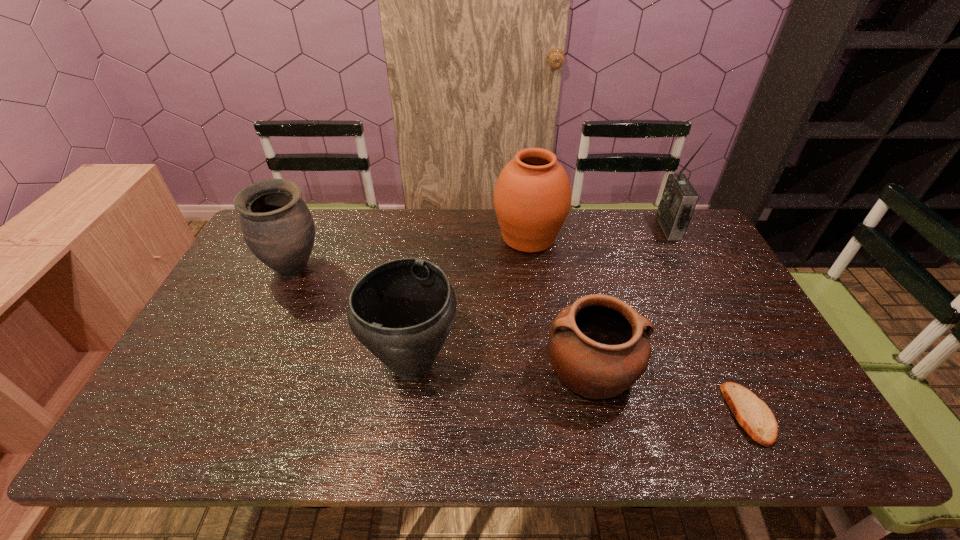
You are a GUI agent. You are given a task and a screenshot of the screen. Output one action in this format:
    pyautogui.click(x=<x>, y=<y>)
    Task: Click on the vacant region located on the right of the rightmost urn
    The height and width of the screenshot is (540, 960).
    Given the screenshot: What is the action you would take?
    pyautogui.click(x=668, y=237)

This screenshot has height=540, width=960. Find the location of `free location located on the right of the leftmost object`. free location located on the right of the leftmost object is located at coordinates (418, 268).

Where is `vacant point located on the left of the second urn from left to right`? The width and height of the screenshot is (960, 540). vacant point located on the left of the second urn from left to right is located at coordinates (216, 364).

The image size is (960, 540). I want to click on vacant position located on the right of the pottery, so click(786, 368).

Locate an element on the screen. free location located 0.290m on the left of the shortest object is located at coordinates (604, 414).

Identify the location of radio receiver positioned at the far edge. (679, 198).

You are a GUI agent. You are given a task and a screenshot of the screen. Output one action in this format:
    pyautogui.click(x=<x>, y=<y>)
    Task: Click on the object located in the near edge section of the desktop
    This screenshot has width=960, height=540.
    Given the screenshot: What is the action you would take?
    pyautogui.click(x=754, y=416)

This screenshot has height=540, width=960. I want to click on object positioned at the left edge, so click(x=277, y=226).

At what (x,y) coordinates should I click in order to perform the action: click on radio receiver at the right edge. Please return your answer as a coordinate pair (x, y). This screenshot has width=960, height=540. Looking at the image, I should click on (679, 198).

In order to click on pita bread present at the right edge in this screenshot , I will do `click(754, 416)`.